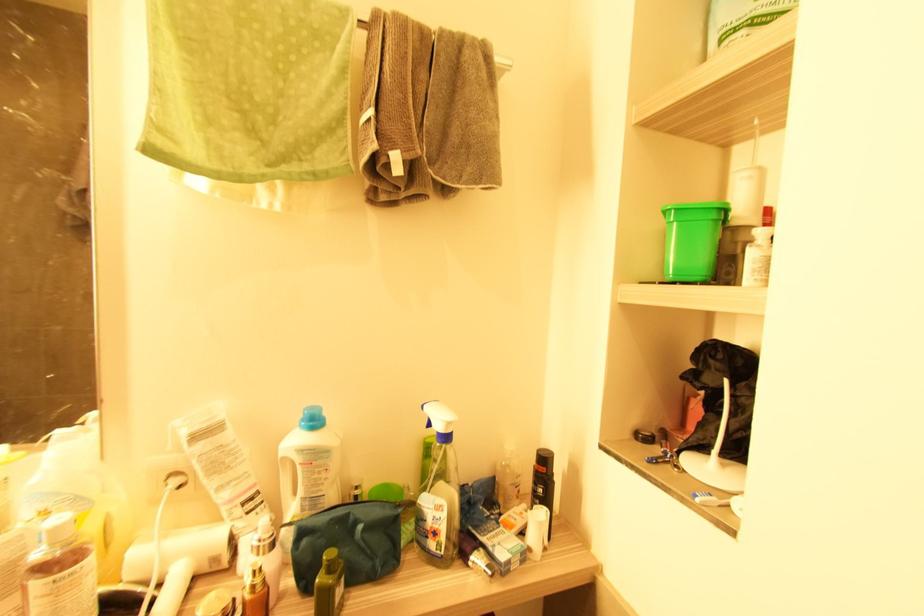
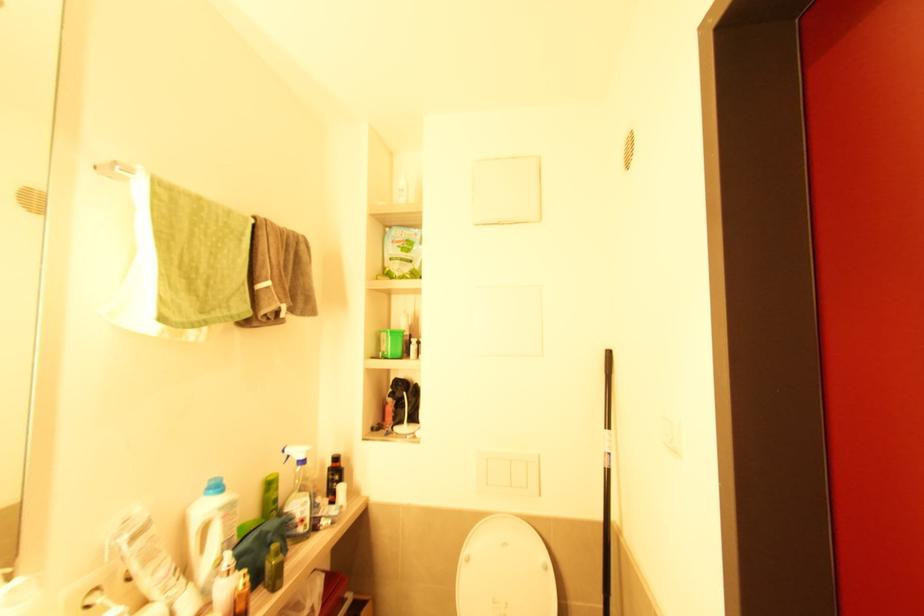
The point at (301, 464) is marked in the first image. Where is the corresponding point in the second image?

(224, 519)